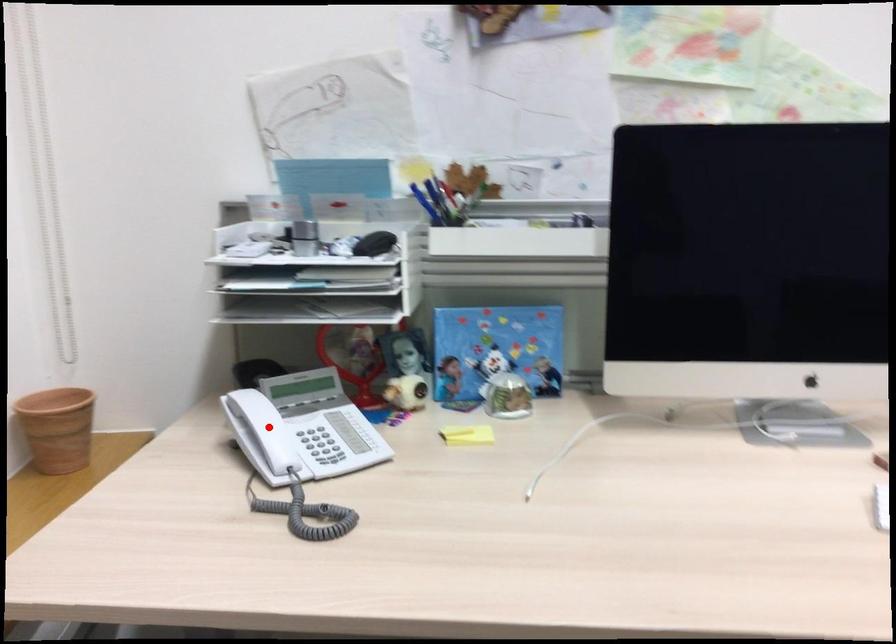
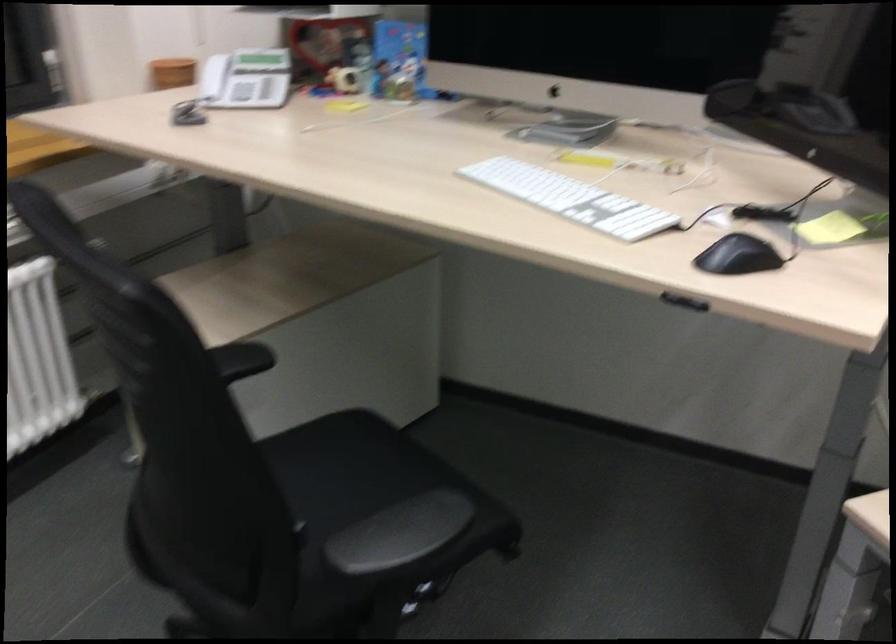
Question: I am providing you with two images of the same scene from different viewpoints. In image1, a red point is highlighted. Considering the same 3D point in image2, which of the following is correct?

Choices:
 (A) It is closer
 (B) It is farther

Answer: (B)